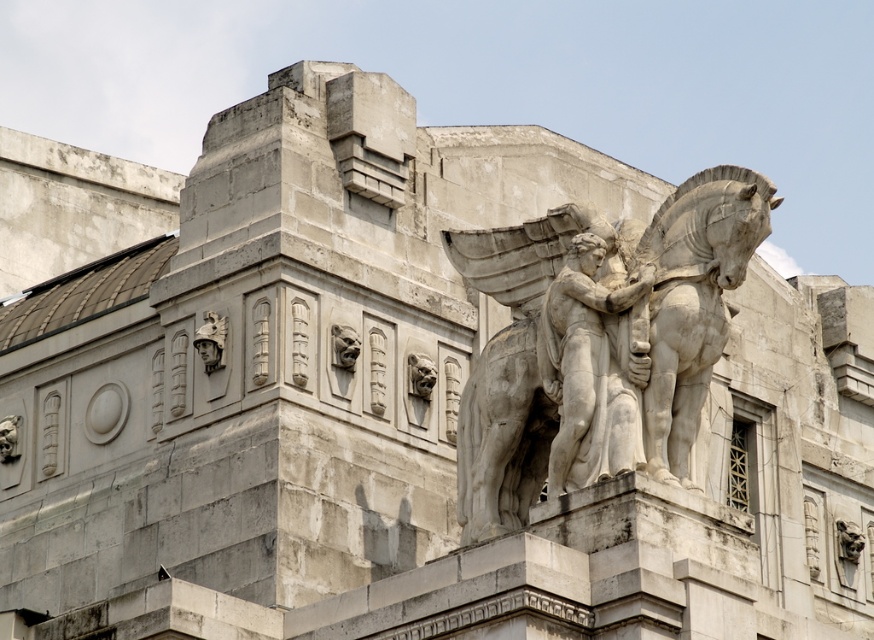
Does white marble statue at upper right have a larger size compared to white marble angel at center?

Yes.

Between white marble statue at upper right and white marble angel at center, which one appears on the right side from the viewer's perspective?

Positioned to the right is white marble angel at center.

The width and height of the screenshot is (874, 640). What do you see at coordinates (598, 342) in the screenshot?
I see `white marble statue at upper right` at bounding box center [598, 342].

At what (x,y) coordinates should I click in order to perform the action: click on white marble statue at upper right. Please return your answer as a coordinate pair (x, y). Looking at the image, I should click on (598, 342).